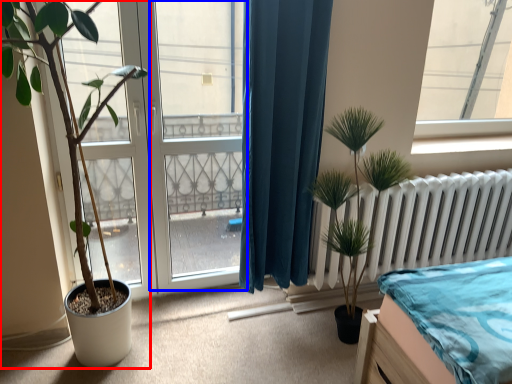
Question: Which object is further to the camera taking this photo, houseplant (highlighted by a red box) or screen door (highlighted by a blue box)?

Choices:
 (A) houseplant
 (B) screen door

Answer: (B)